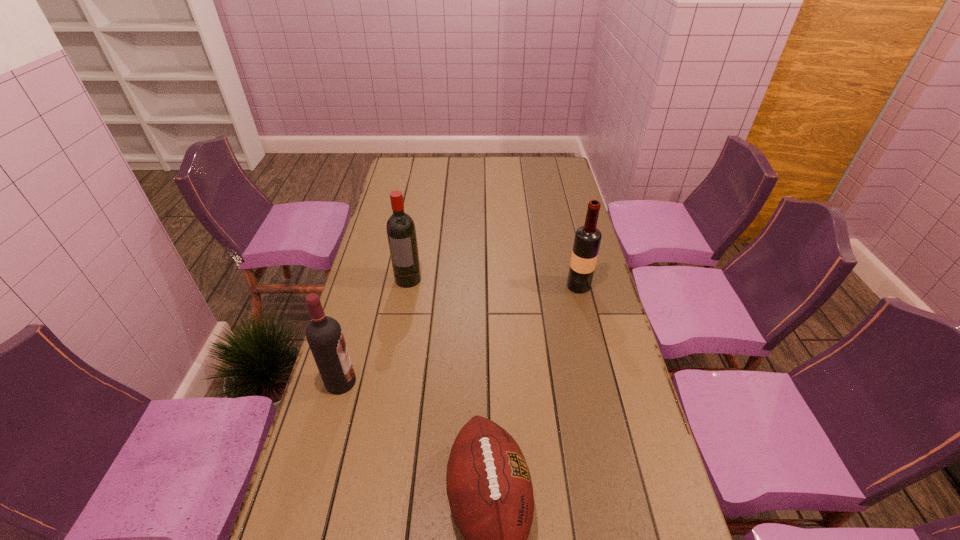
At what (x,y) coordinates should I click in order to perform the action: click on the second object from left to right. Please return your answer as a coordinate pair (x, y). Looking at the image, I should click on (401, 232).

You are a GUI agent. You are given a task and a screenshot of the screen. Output one action in this format:
    pyautogui.click(x=<x>, y=<y>)
    Task: Click on the rightmost object
    The height and width of the screenshot is (540, 960).
    Given the screenshot: What is the action you would take?
    pyautogui.click(x=587, y=240)

At what (x,y) coordinates should I click in order to perform the action: click on the third farthest object. Please return your answer as a coordinate pair (x, y). The image size is (960, 540). Looking at the image, I should click on (324, 335).

You are a GUI agent. You are given a task and a screenshot of the screen. Output one action in this format:
    pyautogui.click(x=<x>, y=<y>)
    Task: Click on the nearest wine bottle
    This screenshot has width=960, height=540.
    Given the screenshot: What is the action you would take?
    pyautogui.click(x=324, y=335)

Where is `free spot located on the label of the second wine bottle from left to right`? Image resolution: width=960 pixels, height=540 pixels. free spot located on the label of the second wine bottle from left to right is located at coordinates (402, 314).

Find the location of a particular element. This screenshot has width=960, height=540. free space located on the front of the rightmost wine bottle is located at coordinates (590, 334).

Where is `vacant space located on the label of the nearest wine bottle`? Image resolution: width=960 pixels, height=540 pixels. vacant space located on the label of the nearest wine bottle is located at coordinates (406, 382).

Find the location of a particular element. The height and width of the screenshot is (540, 960). object at the right edge is located at coordinates (587, 240).

In the image, there is a desktop. Where is `vacant space at the far edge`? This screenshot has width=960, height=540. vacant space at the far edge is located at coordinates (495, 166).

Image resolution: width=960 pixels, height=540 pixels. In the image, there is a desktop. Find the location of `vacant space at the left edge`. vacant space at the left edge is located at coordinates (361, 401).